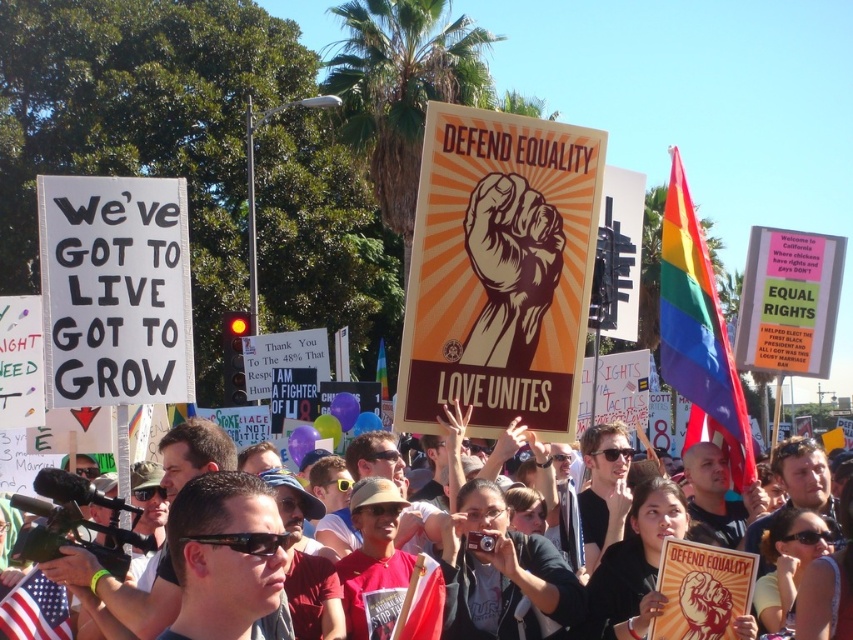
Question: Where is brown wood sign at center located in relation to rainbow fabric flag at upper right in the image?

Choices:
 (A) below
 (B) above

Answer: (A)

Question: Which point is farther from the camera taking this photo?

Choices:
 (A) (218, 545)
 (B) (50, 609)
 (C) (73, 177)

Answer: (C)

Question: Does white paper sign at left appear on the left side of american flag at lower left?

Choices:
 (A) yes
 (B) no

Answer: (B)

Question: Which is nearer to the brown paper fist at center?

Choices:
 (A) black plastic sunglasses at center
 (B) white paper sign at left

Answer: (B)

Question: Which of the following is the closest to the observer?

Choices:
 (A) white paper sign at left
 (B) brown wood sign at center

Answer: (A)

Question: Is white paper sign at left above rainbow fabric flag at center?

Choices:
 (A) no
 (B) yes

Answer: (B)